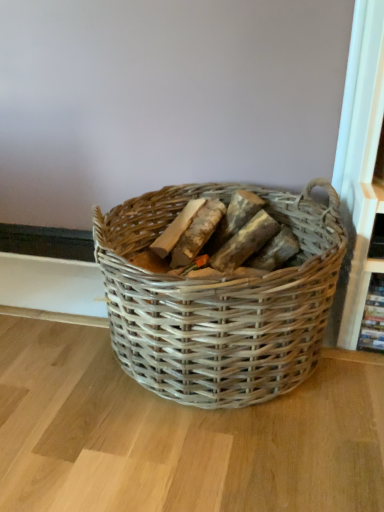
Locate an element on the screen. free spot in front of natural wicker basket at center is located at coordinates (197, 458).